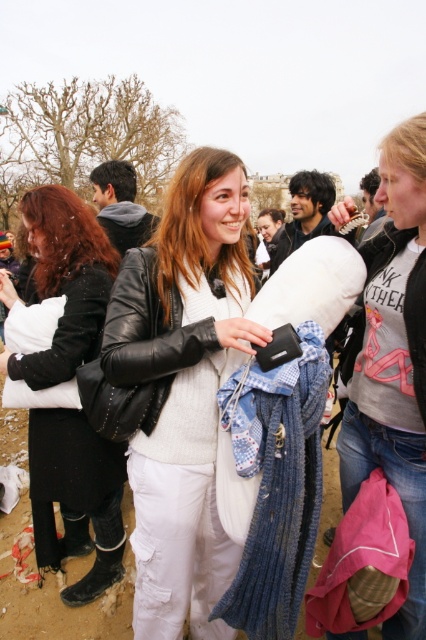
You are a photographer setting up a tripod to capture the scene. The matte black jacket at center and the white fluffy pillow at left are both in your frame. Based on their sizes in the image, which object would appear larger in your photo?

The matte black jacket at center would appear larger in the photo because it is much taller than the white fluffy pillow at left.

You are standing at the center of the image. Where is the matte black jacket at center located relative to your current position?

The matte black jacket at center is located at point (183, 388) relative to the image center.